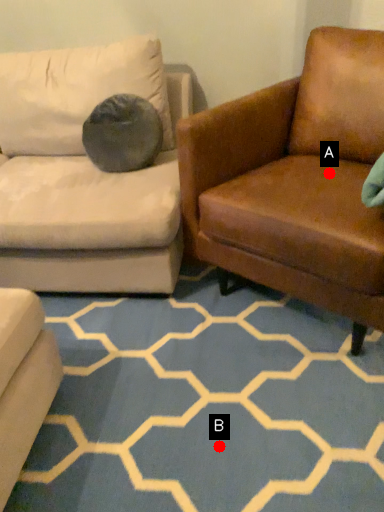
Question: Two points are circled on the image, labeled by A and B beside each circle. Which point is further to the camera?

Choices:
 (A) A is further
 (B) B is further

Answer: (A)